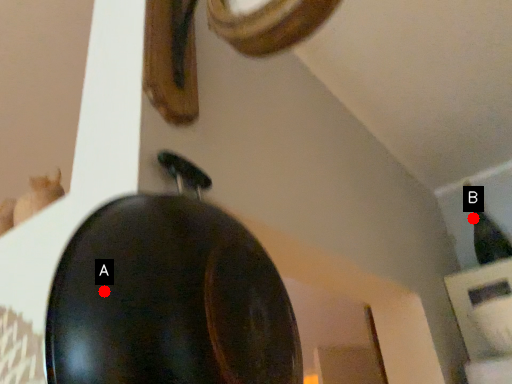
Question: Two points are circled on the image, labeled by A and B beside each circle. Which point appears farthest from the camera in this image?

Choices:
 (A) A is further
 (B) B is further

Answer: (B)